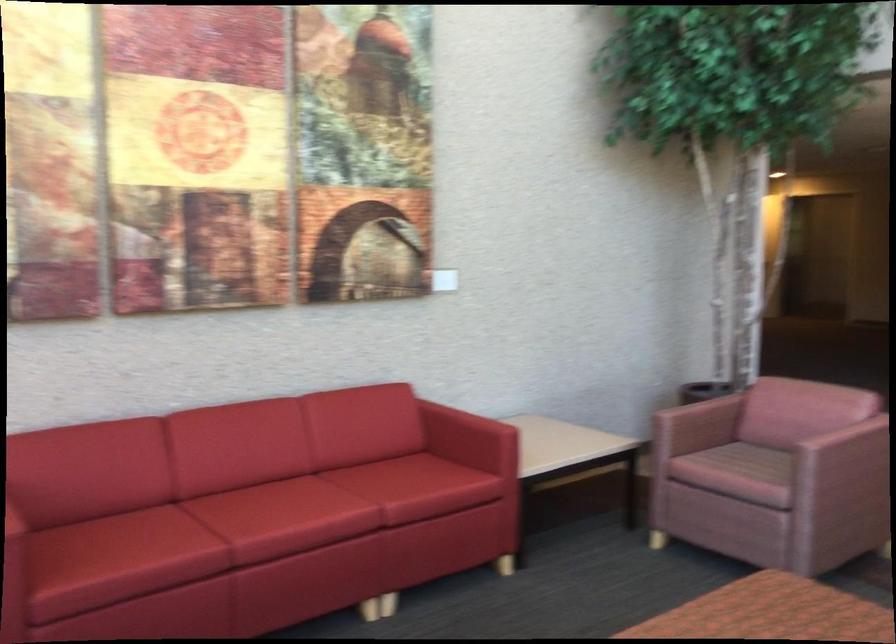
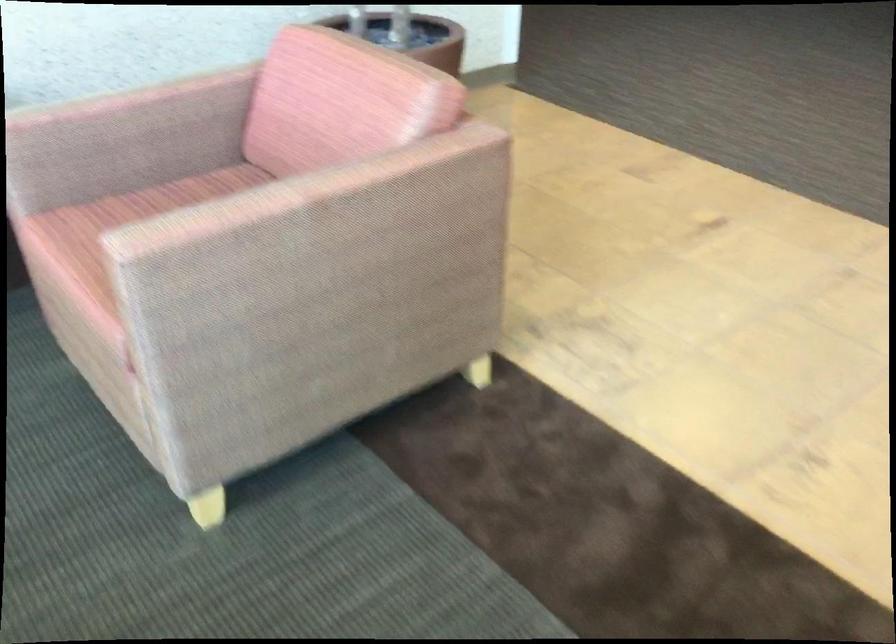
In the second image, find the point that corresponds to (707,400) in the first image.

(121, 98)